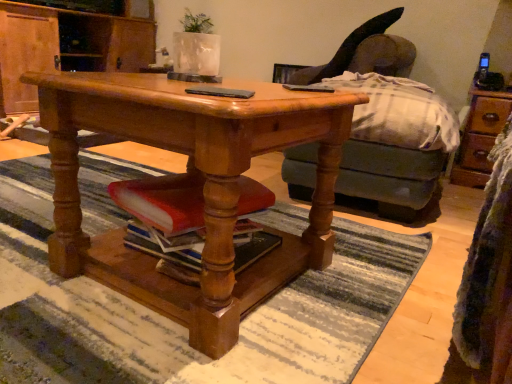
I want to click on velvet dark gray swivel chair at upper right, so click(347, 49).

What do you see at coordinates (196, 46) in the screenshot? The height and width of the screenshot is (384, 512). I see `white textured vase at upper center` at bounding box center [196, 46].

You are a GUI agent. You are given a task and a screenshot of the screen. Output one action in this format:
    pyautogui.click(x=<x>, y=<y>)
    Task: Click on the velvet dark gray swivel chair at upper right
    This screenshot has width=512, height=384.
    Given the screenshot: What is the action you would take?
    pyautogui.click(x=347, y=49)

Can you confirm if white textured vase at upper center is thinner than wooden cabinet at center?

Yes.

I want to click on houseplant behind the wooden cabinet at center, so click(196, 46).

Could you tell me if white textured vase at upper center is facing wooden cabinet at center?

No, white textured vase at upper center does not turn towards wooden cabinet at center.

Considering the relative sizes of white textured vase at upper center and wooden cabinet at center in the image provided, is white textured vase at upper center bigger than wooden cabinet at center?

Actually, white textured vase at upper center might be smaller than wooden cabinet at center.

Does black matte phone at center have a greater width compared to white textured vase at upper center?

No, black matte phone at center is not wider than white textured vase at upper center.

Considering the relative positions of black matte phone at center and white textured vase at upper center in the image provided, is black matte phone at center behind white textured vase at upper center?

No.

Based on the photo, is black matte phone at center touching white textured vase at upper center?

No, black matte phone at center is not making contact with white textured vase at upper center.

Is there a large distance between polished wood desk at center and black matte phone at center?

Actually, polished wood desk at center and black matte phone at center are a little close together.

Which is in front, point (211, 282) or point (243, 92)?

Point (243, 92)

What's the angular difference between polished wood desk at center and black matte phone at center's facing directions?

120 degrees.

Where is `mobile phone that is above the wooden cabinet at center (from a real-world perspective)`? mobile phone that is above the wooden cabinet at center (from a real-world perspective) is located at coordinates (220, 92).

Considering the sizes of objects wooden cabinet at center and black matte phone at center in the image provided, who is wider, wooden cabinet at center or black matte phone at center?

With larger width is wooden cabinet at center.

Is wooden cabinet at center positioned in front of black matte phone at center?

No, wooden cabinet at center is behind black matte phone at center.

From a real-world perspective, which object rests below the other?

polished wood desk at center, from a real-world perspective.

Based on the photo, which object is positioned more to the right, polished wood desk at center or wooden cabinet at center?

From the viewer's perspective, polished wood desk at center appears more on the right side.

Is polished wood desk at center oriented away from wooden cabinet at center?

That's not correct — polished wood desk at center is not looking away from wooden cabinet at center.

Is velvet dark gray swivel chair at upper right located outside white textured vase at upper center?

velvet dark gray swivel chair at upper right is positioned outside white textured vase at upper center.

Which of these two, velvet dark gray swivel chair at upper right or white textured vase at upper center, is smaller?

With smaller size is white textured vase at upper center.

Considering the sizes of objects velvet dark gray swivel chair at upper right and white textured vase at upper center in the image provided, who is thinner, velvet dark gray swivel chair at upper right or white textured vase at upper center?

white textured vase at upper center.

Which object is positioned more to the right, velvet dark gray swivel chair at upper right or white textured vase at upper center?

velvet dark gray swivel chair at upper right.

Is wooden cabinet at center not inside polished wood desk at center?

Yes, wooden cabinet at center is not within polished wood desk at center.

From the image's perspective, is wooden cabinet at center above polished wood desk at center?

Yes, from the image's perspective, wooden cabinet at center is on top of polished wood desk at center.

In terms of height, does wooden cabinet at center look taller or shorter compared to polished wood desk at center?

Considering their sizes, wooden cabinet at center has more height than polished wood desk at center.

In the image, is wooden cabinet at center on the left side or the right side of polished wood desk at center?

wooden cabinet at center is positioned on polished wood desk at center's left side.

The height and width of the screenshot is (384, 512). I want to click on cabinetry in front of the white textured vase at upper center, so click(65, 47).

Locate an element on the screen. This screenshot has width=512, height=384. houseplant above the black matte phone at center (from the image's perspective) is located at coordinates (196, 46).

When comparing their distances from polished wood desk at center, does white textured vase at upper center or wooden cabinet at center seem closer?

Among the two, white textured vase at upper center is located nearer to polished wood desk at center.

Estimate the real-world distances between objects in this image. Which object is further from wooden cabinet at center, white textured vase at upper center or black matte phone at center?

The object further to wooden cabinet at center is black matte phone at center.

From the image, which object appears to be farther from velvet dark gray swivel chair at upper right, wooden cabinet at center or black matte phone at center?

Among the two, black matte phone at center is located further to velvet dark gray swivel chair at upper right.

Considering their positions, is polished wood desk at center positioned further to white textured vase at upper center than wooden cabinet at center?

wooden cabinet at center is further to white textured vase at upper center.

Looking at the image, which one is located further to black matte phone at center, white textured vase at upper center or wooden cabinet at center?

Among the two, wooden cabinet at center is located further to black matte phone at center.

Looking at the image, which one is located closer to polished wood desk at center, wooden cabinet at center or white textured vase at upper center?

white textured vase at upper center lies closer to polished wood desk at center than the other object.

Looking at the image, which one is located further to velvet dark gray swivel chair at upper right, white textured vase at upper center or black matte phone at center?

black matte phone at center is positioned further to the anchor velvet dark gray swivel chair at upper right.

Looking at the image, which one is located closer to wooden cabinet at center, velvet dark gray swivel chair at upper right or black matte phone at center?

velvet dark gray swivel chair at upper right is positioned closer to the anchor wooden cabinet at center.

This screenshot has width=512, height=384. I want to click on swivel chair between polished wood desk at center and white textured vase at upper center from front to back, so click(x=347, y=49).

What are the coordinates of `houseplant located between wooden cabinet at center and velvet dark gray swivel chair at upper right in the left-right direction` in the screenshot? It's located at (196, 46).

The image size is (512, 384). I want to click on mobile phone between polished wood desk at center and velvet dark gray swivel chair at upper right from front to back, so click(220, 92).

Locate an element on the screen. cabinetry between black matte phone at center and white textured vase at upper center along the z-axis is located at coordinates (65, 47).